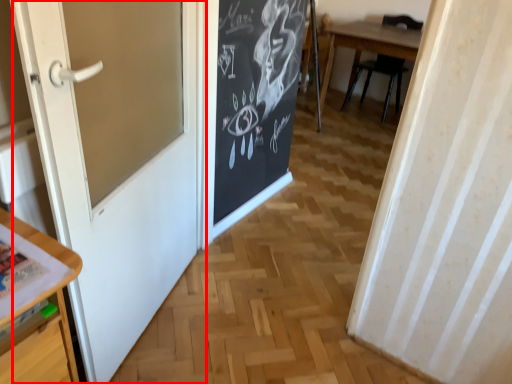
Question: Where is door (annotated by the red box) located in relation to chair in the image?

Choices:
 (A) right
 (B) left

Answer: (B)